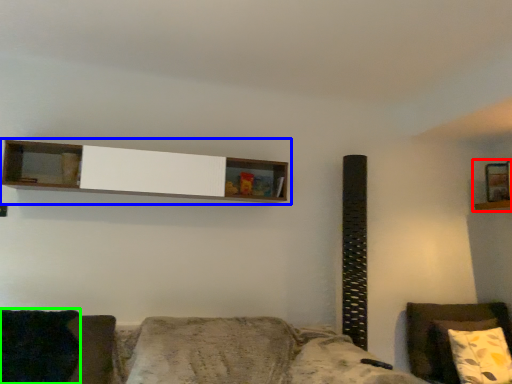
Question: Which object is positioned closest to shelf (highlighted by a red box)? Select from shelf (highlighted by a blue box) and pillow (highlighted by a green box).

Choices:
 (A) shelf
 (B) pillow

Answer: (A)